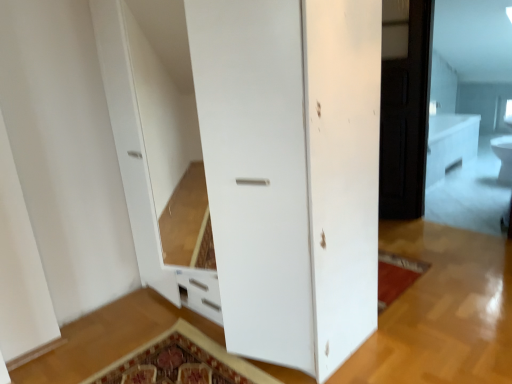
Question: Is dark wood screen door at right wider or thinner than white glossy toilet bowl at upper right?

Choices:
 (A) thin
 (B) wide

Answer: (A)

Question: Is dark wood screen door at right taller or shorter than white glossy toilet bowl at upper right?

Choices:
 (A) short
 (B) tall

Answer: (B)

Question: From a real-world perspective, is dark wood screen door at right positioned above or below white glossy toilet bowl at upper right?

Choices:
 (A) below
 (B) above

Answer: (B)

Question: From the image's perspective, relative to dark wood screen door at right, is white glossy toilet bowl at upper right above or below?

Choices:
 (A) above
 (B) below

Answer: (B)

Question: Based on their sizes in the image, would you say white glossy toilet bowl at upper right is bigger or smaller than dark wood screen door at right?

Choices:
 (A) big
 (B) small

Answer: (B)

Question: Choose the correct answer: Is white glossy toilet bowl at upper right inside dark wood screen door at right or outside it?

Choices:
 (A) inside
 (B) outside

Answer: (B)

Question: Is point (496, 152) positioned closer to the camera than point (414, 147)?

Choices:
 (A) closer
 (B) farther

Answer: (B)